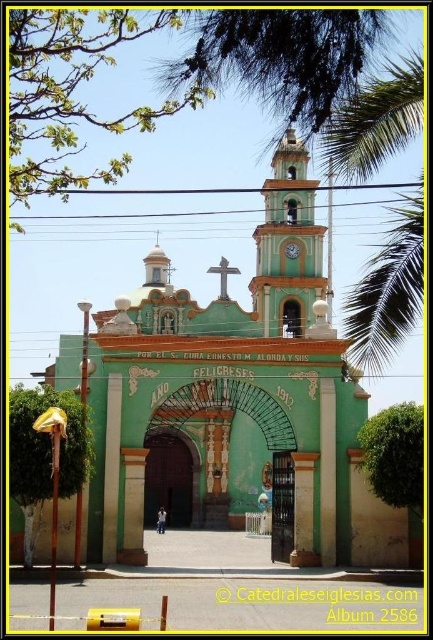
Question: In this image, where is green leafy palm tree at upper right located relative to green painted wood clock at center?

Choices:
 (A) above
 (B) below

Answer: (A)

Question: Does green leafy palm tree at upper right have a smaller size compared to green painted wood clock at center?

Choices:
 (A) no
 (B) yes

Answer: (A)

Question: Is green painted stone church at center closer to camera compared to green painted wood clock at center?

Choices:
 (A) yes
 (B) no

Answer: (A)

Question: Which object is closer to the camera taking this photo?

Choices:
 (A) green leafy palm tree at upper right
 (B) green painted stone church at center
 (C) green painted wood clock at center
 (D) green leafy palm at upper right

Answer: (A)

Question: Which is farther from the green leafy palm tree at upper right?

Choices:
 (A) green painted stone church at center
 (B) green leafy palm at upper right

Answer: (A)

Question: Estimate the real-world distances between objects in this image. Which object is farther from the green painted wood clock at center?

Choices:
 (A) green painted stone church at center
 (B) green leafy palm tree at upper right
 (C) green leafy palm at upper right

Answer: (B)